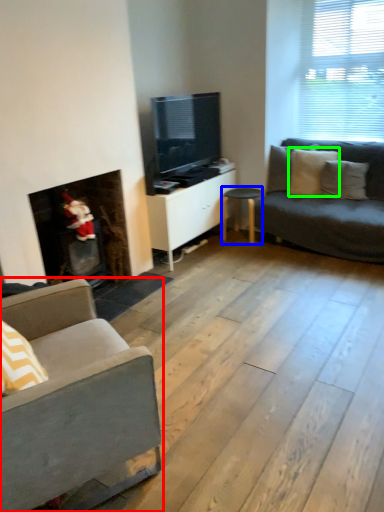
Question: Which object is the closest to the studio couch (highlighted by a red box)? Choose among these: table (highlighted by a blue box) or pillow (highlighted by a green box).

Choices:
 (A) table
 (B) pillow

Answer: (A)